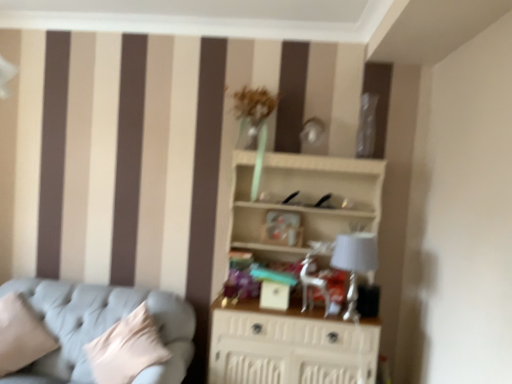
Question: Relative to white wood shelf at center, is beige fabric pillow at lower left in front or behind?

Choices:
 (A) front
 (B) behind

Answer: (A)

Question: Is point (28, 347) closer or farther from the camera than point (293, 173)?

Choices:
 (A) closer
 (B) farther

Answer: (A)

Question: Which object is the closest to the light blue fabric couch at lower left?

Choices:
 (A) silver metallic swivel chair at center
 (B) white wood shelf at center
 (C) beige fabric pillow at lower left
 (D) white fabric lampshade at right

Answer: (C)

Question: Estimate the real-world distances between objects in this image. Which object is closer to the beige fabric pillow at lower left?

Choices:
 (A) light blue fabric couch at lower left
 (B) silver metallic swivel chair at center
 (C) white fabric lampshade at right
 (D) white wood shelf at center

Answer: (A)